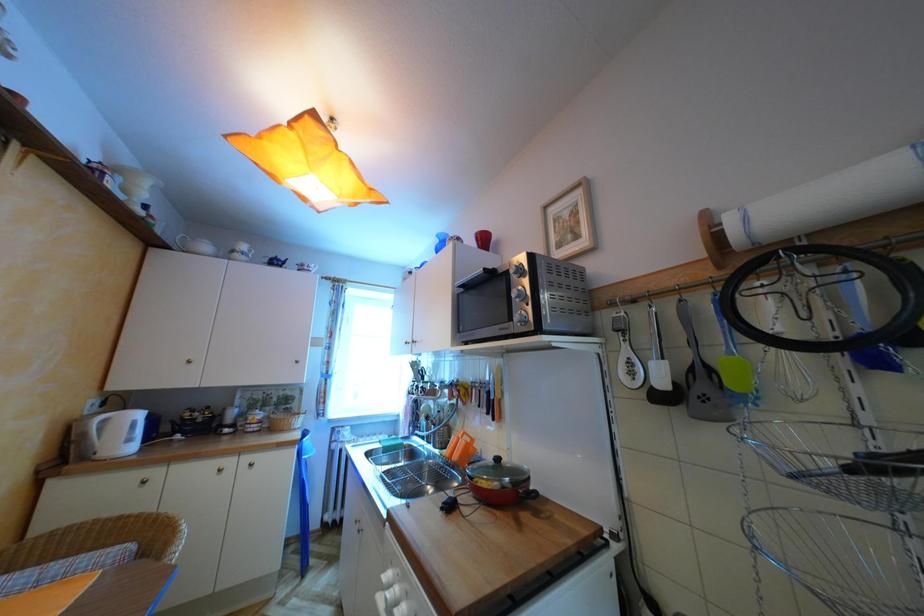
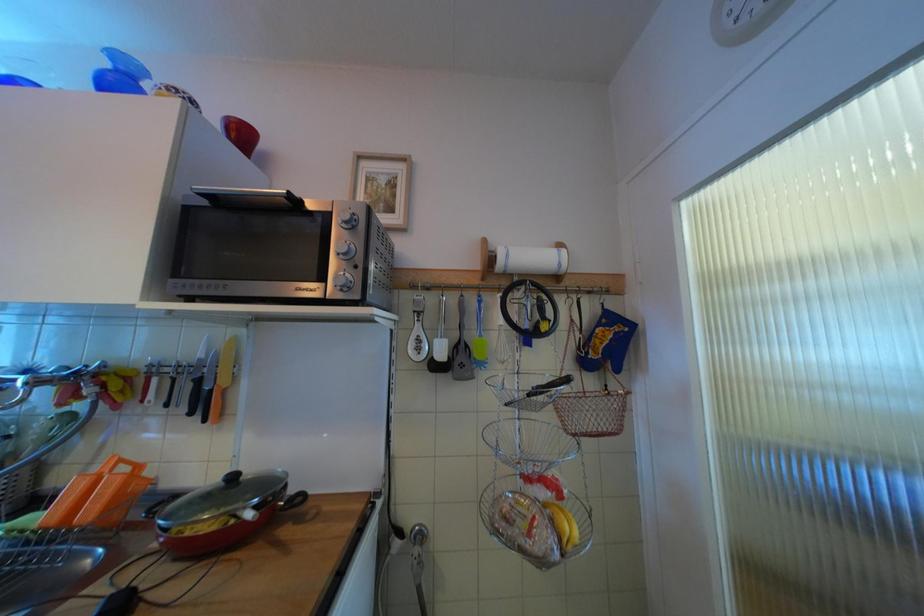
Question: How did the camera likely rotate?

Choices:
 (A) Left
 (B) Right
 (C) Up
 (D) Down

Answer: (B)